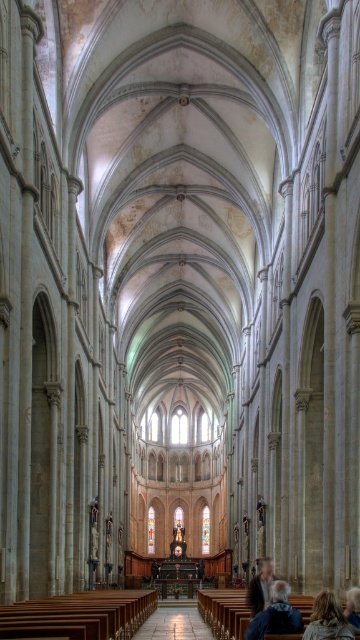
You are standing in the cathedral and see two people in the scene. One has blonde hair at lower right and the other has gray hair at center. Which person is closer to you?

The blonde hair at lower right is closer to the viewer than the gray hair at center.

You are a tour guide leading a group through the cathedral. You want to move from the dark brown leather jacket at lower center to the blonde hair at lower right. Is there enough space for you to walk directly between them without any obstacles?

The distance between the dark brown leather jacket at lower center and the blonde hair at lower right is 73.83 feet, so there is sufficient space for you to walk directly between them without any obstacles.